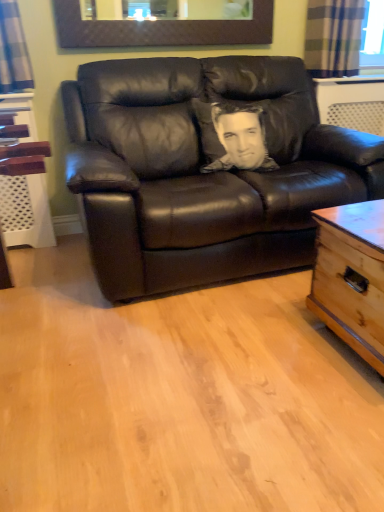
Question: From a real-world perspective, does sepia-toned pillow at center sit lower than matte brown picture frame at upper center?

Choices:
 (A) no
 (B) yes

Answer: (B)

Question: Is sepia-toned pillow at center next to matte brown picture frame at upper center?

Choices:
 (A) no
 (B) yes

Answer: (A)

Question: Is sepia-toned pillow at center to the right of matte brown picture frame at upper center from the viewer's perspective?

Choices:
 (A) no
 (B) yes

Answer: (B)

Question: Is sepia-toned pillow at center not close to matte brown picture frame at upper center?

Choices:
 (A) no
 (B) yes

Answer: (A)

Question: From the image's perspective, is sepia-toned pillow at center on matte brown picture frame at upper center?

Choices:
 (A) yes
 (B) no

Answer: (B)

Question: Does sepia-toned pillow at center turn towards matte brown picture frame at upper center?

Choices:
 (A) no
 (B) yes

Answer: (A)

Question: Is light brown wooden trunk at right turned away from plaid fabric curtain at upper right?

Choices:
 (A) no
 (B) yes

Answer: (A)

Question: Is light brown wooden trunk at right thinner than plaid fabric curtain at upper right?

Choices:
 (A) no
 (B) yes

Answer: (A)

Question: Are light brown wooden trunk at right and plaid fabric curtain at upper right located far from each other?

Choices:
 (A) yes
 (B) no

Answer: (A)

Question: Can we say light brown wooden trunk at right lies outside plaid fabric curtain at upper right?

Choices:
 (A) yes
 (B) no

Answer: (A)

Question: Could you tell me if light brown wooden trunk at right is facing plaid fabric curtain at upper right?

Choices:
 (A) no
 (B) yes

Answer: (A)

Question: From a real-world perspective, does light brown wooden trunk at right sit lower than plaid fabric curtain at upper right?

Choices:
 (A) yes
 (B) no

Answer: (A)

Question: Is plaid fabric curtain at upper right wider than light brown wooden trunk at right?

Choices:
 (A) no
 (B) yes

Answer: (A)